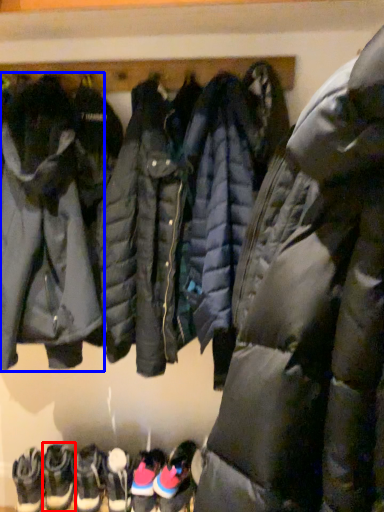
Question: Which object appears closest to the camera in this image, footwear (highlighted by a red box) or jacket (highlighted by a blue box)?

Choices:
 (A) footwear
 (B) jacket

Answer: (B)